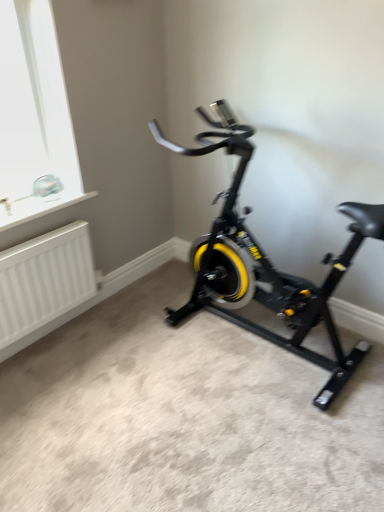
Question: Does point (23, 306) appear closer or farther from the camera than point (215, 132)?

Choices:
 (A) closer
 (B) farther

Answer: (A)

Question: Is white matte radiator at lower left inside or outside of black matte stationary bicycle at center?

Choices:
 (A) outside
 (B) inside

Answer: (A)

Question: From the image's perspective, relative to black matte stationary bicycle at center, is white matte radiator at lower left above or below?

Choices:
 (A) above
 (B) below

Answer: (B)

Question: From the image's perspective, is black matte stationary bicycle at center positioned above or below white matte radiator at lower left?

Choices:
 (A) below
 (B) above

Answer: (B)

Question: From a real-world perspective, is black matte stationary bicycle at center above or below white matte radiator at lower left?

Choices:
 (A) above
 (B) below

Answer: (A)

Question: In the image, is black matte stationary bicycle at center on the left side or the right side of white matte radiator at lower left?

Choices:
 (A) right
 (B) left

Answer: (A)

Question: Is black matte stationary bicycle at center wider or thinner than white matte radiator at lower left?

Choices:
 (A) wide
 (B) thin

Answer: (A)